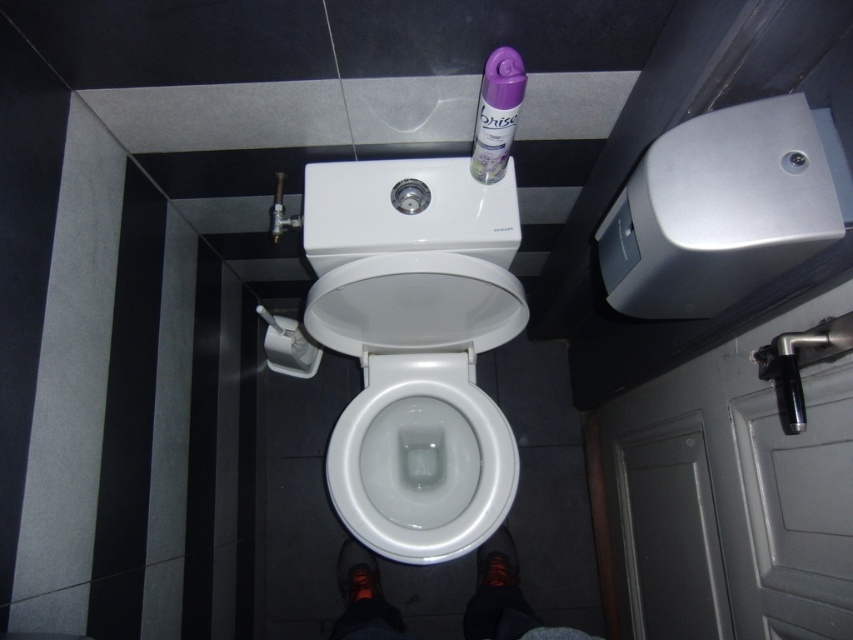
Question: Can you confirm if white glossy toilet bowl at center is thinner than purple plastic spray can at upper center?

Choices:
 (A) no
 (B) yes

Answer: (A)

Question: Which object is closer to the camera taking this photo?

Choices:
 (A) white glossy toilet bowl at center
 (B) purple plastic spray can at upper center

Answer: (B)

Question: Is white glossy toilet bowl at center bigger than purple plastic spray can at upper center?

Choices:
 (A) yes
 (B) no

Answer: (A)

Question: Which object is closer to the camera taking this photo?

Choices:
 (A) white glossy toilet bowl at center
 (B) purple plastic spray can at upper center

Answer: (B)

Question: Is white glossy toilet bowl at center behind purple plastic spray can at upper center?

Choices:
 (A) yes
 (B) no

Answer: (A)

Question: Which of the following is the farthest from the observer?

Choices:
 (A) tap(502, 58)
 (B) tap(422, 532)

Answer: (B)